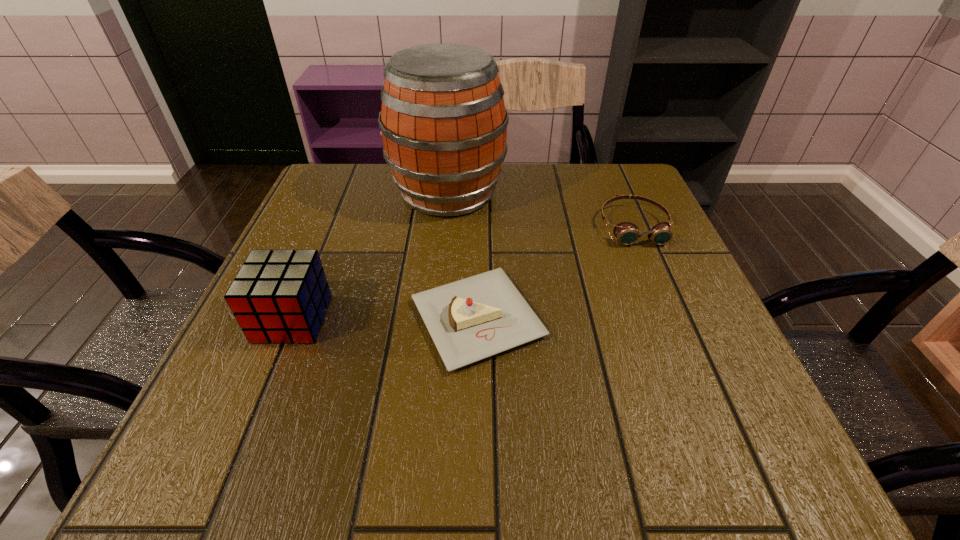
This screenshot has height=540, width=960. Find the location of `cider`. cider is located at coordinates (443, 121).

In order to click on the leftmost object in this screenshot , I will do `click(278, 296)`.

The height and width of the screenshot is (540, 960). Find the location of `cube`. cube is located at coordinates (278, 296).

The height and width of the screenshot is (540, 960). In order to click on cake in this screenshot , I will do `click(477, 317)`.

Where is `the rightmost object`? the rightmost object is located at coordinates click(x=627, y=233).

The height and width of the screenshot is (540, 960). Identify the location of blank area located on the left of the tallest object. pos(330,193).

Locate an element on the screen. This screenshot has height=540, width=960. vacant space located 0.340m on the back of the cube is located at coordinates (343, 197).

Where is `free space located 0.150m on the front of the cake`? The image size is (960, 540). free space located 0.150m on the front of the cake is located at coordinates (477, 470).

This screenshot has height=540, width=960. What are the coordinates of `vacant space located 0.120m through the lenses of the rightmost object` in the screenshot? It's located at [x=660, y=287].

I want to click on cider present at the far edge, so click(443, 121).